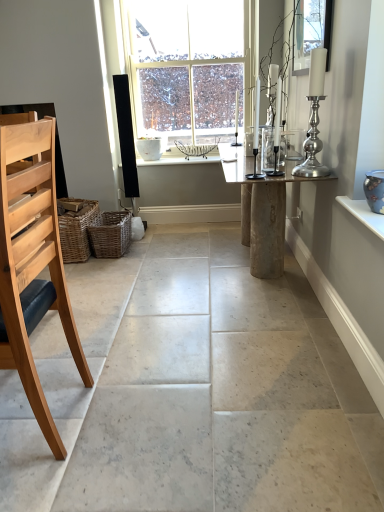
This screenshot has width=384, height=512. What do you see at coordinates (77, 232) in the screenshot?
I see `woven brown basket at lower left, arranged as the second basket when viewed from the right` at bounding box center [77, 232].

Find the location of a particular element. Image resolution: width=384 pixels, height=512 pixels. woven brown basket at lower left, arranged as the second basket when viewed from the right is located at coordinates (77, 232).

This screenshot has width=384, height=512. I want to click on clear glass window at center, so click(x=187, y=67).

This screenshot has height=512, width=384. What are the coordinates of `blue glossy vase at upper right` in the screenshot? It's located at (375, 190).

This screenshot has width=384, height=512. Describe the element at coordinates (314, 118) in the screenshot. I see `silver metallic candle holder at upper right` at that location.

In order to face rustic wood table at center, should I rotate leftwards or rightwards?

To align with it, rotate right about 8.913°.

Describe the element at coordinates (32, 261) in the screenshot. I see `natural wood chair at left` at that location.

Find the location of a particular element. The height and width of the screenshot is (512, 384). woven brown basket at lower left, arranged as the 1th basket when viewed from the left is located at coordinates (77, 232).

From the image's perspective, is silver metallic candle holder at upper right located above or below blue glossy vase at upper right?

silver metallic candle holder at upper right is situated higher than blue glossy vase at upper right in the image.

Is point (316, 161) behind point (376, 182)?

Yes, point (316, 161) is behind point (376, 182).

Considering the relative sizes of silver metallic candle holder at upper right and blue glossy vase at upper right in the image provided, is silver metallic candle holder at upper right thinner than blue glossy vase at upper right?

Correct, the width of silver metallic candle holder at upper right is less than that of blue glossy vase at upper right.

Can you confirm if natural wood chair at left is positioned to the right of silver metallic candle holder at upper right?

Incorrect, natural wood chair at left is not on the right side of silver metallic candle holder at upper right.

Is natural wood chair at left positioned with its back to silver metallic candle holder at upper right?

No, natural wood chair at left is not facing away from silver metallic candle holder at upper right.

From a real-world perspective, who is located higher, natural wood chair at left or silver metallic candle holder at upper right?

silver metallic candle holder at upper right is physically above.

Are natural wood chair at left and silver metallic candle holder at upper right far apart?

Yes, natural wood chair at left is far from silver metallic candle holder at upper right.

Would you consider woven brown basket at lower left, the 2th basket when ordered from left to right, to be distant from white marble window sill at center?

No, woven brown basket at lower left, the 2th basket when ordered from left to right, is not far from white marble window sill at center.

Considering the sizes of objects woven brown basket at lower left, the 2th basket when ordered from left to right, and white marble window sill at center in the image provided, who is taller, woven brown basket at lower left, the 2th basket when ordered from left to right, or white marble window sill at center?

woven brown basket at lower left, the 2th basket when ordered from left to right, is taller.

From a real-world perspective, between woven brown basket at lower left, the 2th basket when ordered from left to right, and white marble window sill at center, who is vertically lower?

woven brown basket at lower left, the 2th basket when ordered from left to right, from a real-world perspective.

From the image's perspective, is woven brown basket at lower left, positioned as the first basket in right-to-left order, located above white marble window sill at center?

No, from the image's perspective, woven brown basket at lower left, positioned as the first basket in right-to-left order, is not on top of white marble window sill at center.

Is white marble window sill at center taller than silver metallic candle holder at upper right?

No, white marble window sill at center is not taller than silver metallic candle holder at upper right.

Which is less distant, (x=120, y=167) or (x=316, y=117)?

The point (x=316, y=117) is closer to the camera.

At what (x,y) coordinates should I click in order to perform the action: click on candle holder on the right of white marble window sill at center. Please return your answer as a coordinate pair (x, y). Image resolution: width=384 pixels, height=512 pixels. Looking at the image, I should click on (314, 118).

Is point (262, 181) positioned before point (79, 220)?

Yes.

Is rustic wood table at center to the right of woven brown basket at lower left, arranged as the 1th basket when viewed from the left, from the viewer's perspective?

Indeed, rustic wood table at center is positioned on the right side of woven brown basket at lower left, arranged as the 1th basket when viewed from the left.

Is rustic wood table at center far away from woven brown basket at lower left, arranged as the 1th basket when viewed from the left?

Absolutely, rustic wood table at center is distant from woven brown basket at lower left, arranged as the 1th basket when viewed from the left.

From the picture: Is woven brown basket at lower left, arranged as the 1th basket when viewed from the left, surrounded by rustic wood table at center?

No.

Is clear glass window at center touching silver metallic candle holder at upper right?

No.

From the image's perspective, between clear glass window at center and silver metallic candle holder at upper right, who is located below?

silver metallic candle holder at upper right appears lower in the image.

Would you say clear glass window at center contains silver metallic candle holder at upper right?

No, clear glass window at center does not contain silver metallic candle holder at upper right.

Considering the positions of objects clear glass window at center and silver metallic candle holder at upper right in the image provided, who is more to the left, clear glass window at center or silver metallic candle holder at upper right?

From the viewer's perspective, clear glass window at center appears more on the left side.

Does point (210, 75) come farther from viewer compared to point (264, 278)?

Yes.

Does clear glass window at center appear on the right side of rustic wood table at center?

No.

From a real-world perspective, which object stands above the other?

clear glass window at center.

From the image's perspective, is clear glass window at center below rustic wood table at center?

No, from the image's perspective, clear glass window at center is not below rustic wood table at center.

At what (x,y) coordinates should I click in order to perform the action: click on candle holder lying behind the blue glossy vase at upper right. Please return your answer as a coordinate pair (x, y). Looking at the image, I should click on (314, 118).

Image resolution: width=384 pixels, height=512 pixels. I want to click on chair in front of the silver metallic candle holder at upper right, so click(32, 261).

Which object lies further to the anchor point woven brown basket at lower left, arranged as the 1th basket when viewed from the left, clear glass window at center or silver metallic candle holder at upper right?

Among the two, silver metallic candle holder at upper right is located further to woven brown basket at lower left, arranged as the 1th basket when viewed from the left.

Looking at the image, which one is located further to clear glass window at center, white marble window sill at center or blue glossy vase at upper right?

Among the two, blue glossy vase at upper right is located further to clear glass window at center.

From the image, which object appears to be nearer to silver metallic candle holder at upper right, woven brown basket at lower left, positioned as the first basket in right-to-left order, or natural wood chair at left?

natural wood chair at left is positioned closer to the anchor silver metallic candle holder at upper right.

From the picture: Considering their positions, is blue glossy vase at upper right positioned closer to silver metallic candle holder at upper right than clear glass candlestick at upper right?

The object closer to silver metallic candle holder at upper right is clear glass candlestick at upper right.

When comparing their distances from rustic wood table at center, does white marble window sill at center or woven brown basket at lower left, arranged as the 1th basket when viewed from the left, seem further?

woven brown basket at lower left, arranged as the 1th basket when viewed from the left.

Which object lies further to the anchor point natural wood chair at left, woven brown basket at lower left, the 2th basket when ordered from left to right, or clear glass window at center?

Among the two, clear glass window at center is located further to natural wood chair at left.

Based on their spatial positions, is woven brown basket at lower left, positioned as the first basket in right-to-left order, or clear glass window at center further from white marble window sill at center?

The object further to white marble window sill at center is woven brown basket at lower left, positioned as the first basket in right-to-left order.

Based on their spatial positions, is natural wood chair at left or silver metallic candle holder at upper right further from rustic wood table at center?

natural wood chair at left lies further to rustic wood table at center than the other object.

Locate an element on the screen. The image size is (384, 512). window between natural wood chair at left and white marble window sill at center in the front-back direction is located at coordinates (187, 67).

The width and height of the screenshot is (384, 512). I want to click on window screen positioned between natural wood chair at left and clear glass window at center from near to far, so [x=311, y=32].

At what (x,y) coordinates should I click in order to perform the action: click on table between woven brown basket at lower left, arranged as the 1th basket when viewed from the left, and clear glass candlestick at upper right from left to right. Please return your answer as a coordinate pair (x, y). The width and height of the screenshot is (384, 512). Looking at the image, I should click on (263, 214).

This screenshot has height=512, width=384. Identify the location of window screen positioned between blue glossy vase at upper right and white marble window sill at center from near to far. (311, 32).